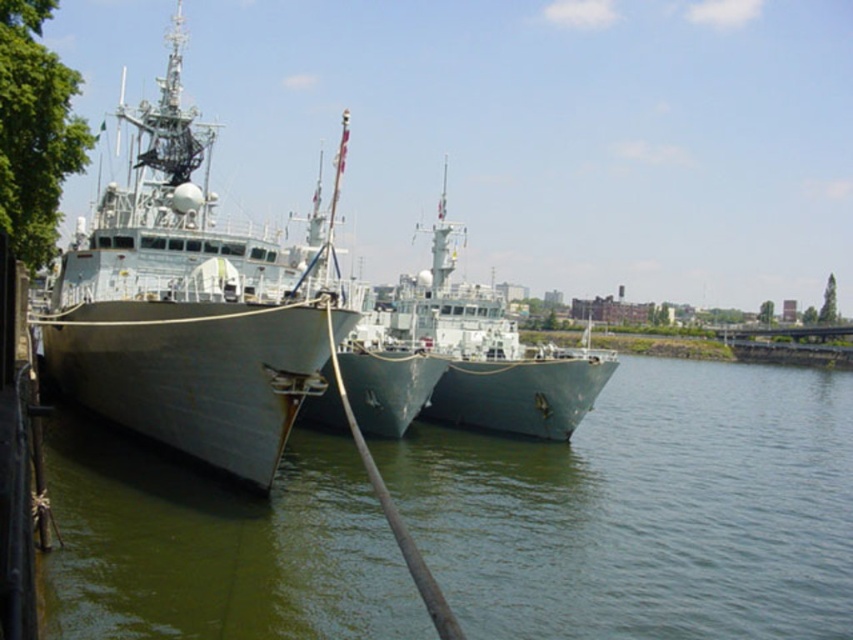
Question: Which object is the closest to the greenish water at center?

Choices:
 (A) green matte ship at center
 (B) metallic gray ship at left

Answer: (B)

Question: Does greenish water at center appear over metallic gray ship at left?

Choices:
 (A) no
 (B) yes

Answer: (A)

Question: Is greenish water at center above green matte ship at center?

Choices:
 (A) yes
 (B) no

Answer: (B)

Question: Is greenish water at center positioned before metallic gray ship at left?

Choices:
 (A) no
 (B) yes

Answer: (B)

Question: Which point is farther from the camera taking this photo?

Choices:
 (A) (434, 284)
 (B) (830, 467)

Answer: (A)

Question: Which point is farther to the camera?

Choices:
 (A) (556, 426)
 (B) (136, 317)

Answer: (A)